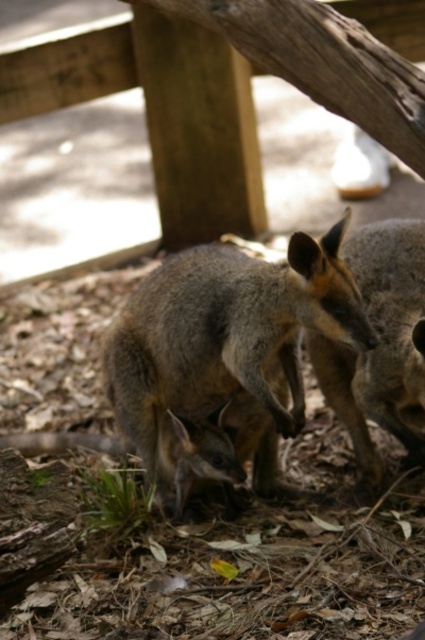
You are a zookeeper who needs to place a divider between the gray fur kangaroo at center and the brown fur kangaroo at center to separate them. The divider you have is 12 inches wide. Will the divider fit between them without overlapping either animal?

The gray fur kangaroo at center and brown fur kangaroo at center are 13.44 inches apart. Since the divider is 12 inches wide, it can fit between them as the space is larger than the divider. However, there will be a small gap of 1.44 inches remaining between the divider and each animal, so it won t fully block access but will provide some separation.

From the picture: You are a zookeeper who wants to feed both kangaroos. Since the gray fur kangaroo at center is taller than the brown fur kangaroo at center, which one would you need to place the food higher for?

The gray fur kangaroo at center is taller than the brown fur kangaroo at center, so you should place the food higher for the gray fur kangaroo at center to ensure it can reach comfortably.

You are a zookeeper observing two wallabies in their enclosure. You notice a gray fur kangaroo at center and a brown fur kangaroo at center. Which one is positioned more to the left side of the enclosure?

The gray fur kangaroo at center is positioned to the left of the brown fur kangaroo at center, so it is more to the left side of the enclosure.